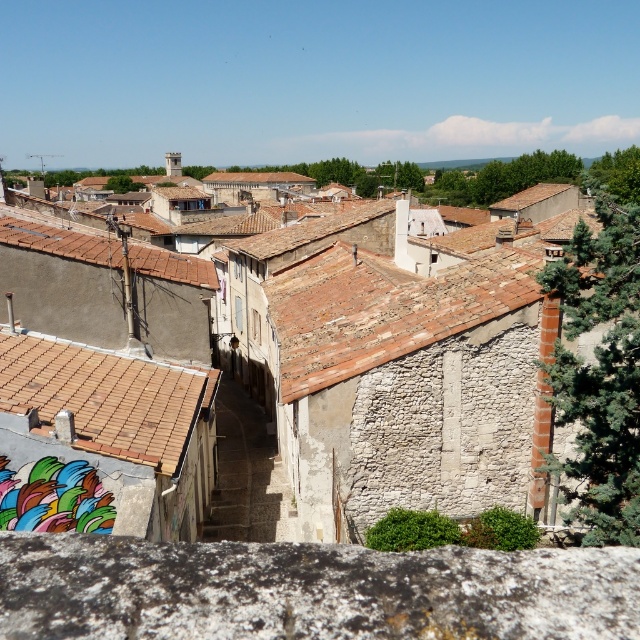
Question: Can you confirm if rustic stone buildings at center is wider than brown tiled roof at lower left?

Choices:
 (A) yes
 (B) no

Answer: (A)

Question: Which point is farther to the camera?

Choices:
 (A) rustic stone buildings at center
 (B) brown tiled roof at lower left

Answer: (B)

Question: Is rustic stone buildings at center positioned at the back of brown tile roof at left?

Choices:
 (A) no
 (B) yes

Answer: (A)

Question: Which object is farther from the camera taking this photo?

Choices:
 (A) rustic stone buildings at center
 (B) brown tiled roof at lower left
 (C) brown tile roof at left

Answer: (C)

Question: Which is nearer to the brown tiled roof at lower left?

Choices:
 (A) rustic stone buildings at center
 (B) brown tile roof at left

Answer: (B)

Question: Does rustic stone buildings at center have a larger size compared to brown tile roof at left?

Choices:
 (A) yes
 (B) no

Answer: (A)